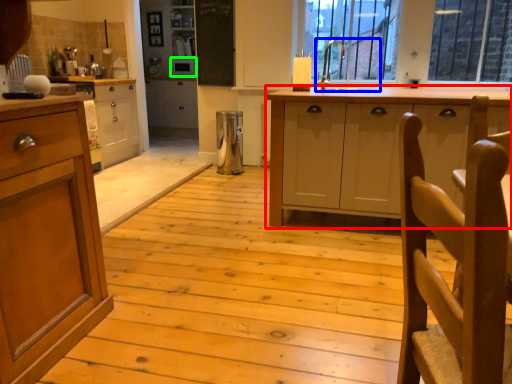
Question: Considering the real-world distances, which object is farthest from cabinetry (highlighted by a red box)? sink (highlighted by a blue box) or appliance (highlighted by a green box)?

Choices:
 (A) sink
 (B) appliance

Answer: (B)